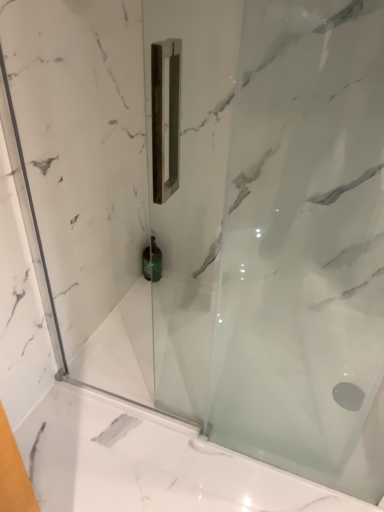
Measure the distance between point (144, 266) and camera.

Point (144, 266) and camera are 5.26 feet apart.

What do you see at coordinates (152, 262) in the screenshot? I see `green glass bottle at center` at bounding box center [152, 262].

Locate an element on the screen. The width and height of the screenshot is (384, 512). green glass bottle at center is located at coordinates (152, 262).

This screenshot has width=384, height=512. In order to click on green glass bottle at center in this screenshot , I will do `click(152, 262)`.